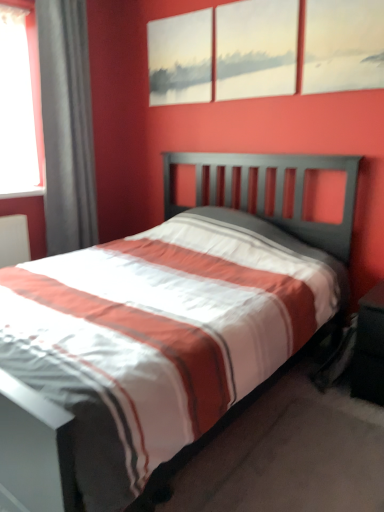
Question: Is matte white canvas at upper center, the 2th picture frame positioned from the left, bigger or smaller than matte canvas painting at upper center, arranged as the 3th picture frame when viewed from the left?

Choices:
 (A) small
 (B) big

Answer: (B)

Question: Considering the positions of point (253, 93) and point (311, 83), is point (253, 93) closer or farther from the camera than point (311, 83)?

Choices:
 (A) farther
 (B) closer

Answer: (A)

Question: Which object is positioned farthest from the matte canvas painting at upper center, the first picture frame in the right-to-left sequence?

Choices:
 (A) matte gray painting at upper center, marked as the 3th picture frame in a right-to-left arrangement
 (B) white striped fabric at center
 (C) black matte nightstand at lower right
 (D) matte white canvas at upper center, the second picture frame positioned from the right
 (E) gray fabric curtain at left

Answer: (E)

Question: Considering the real-world distances, which object is closest to the white striped fabric at center?

Choices:
 (A) matte white canvas at upper center, the second picture frame positioned from the right
 (B) matte canvas painting at upper center, the first picture frame in the right-to-left sequence
 (C) matte gray painting at upper center, marked as the 3th picture frame in a right-to-left arrangement
 (D) gray fabric curtain at left
 (E) black matte nightstand at lower right

Answer: (E)